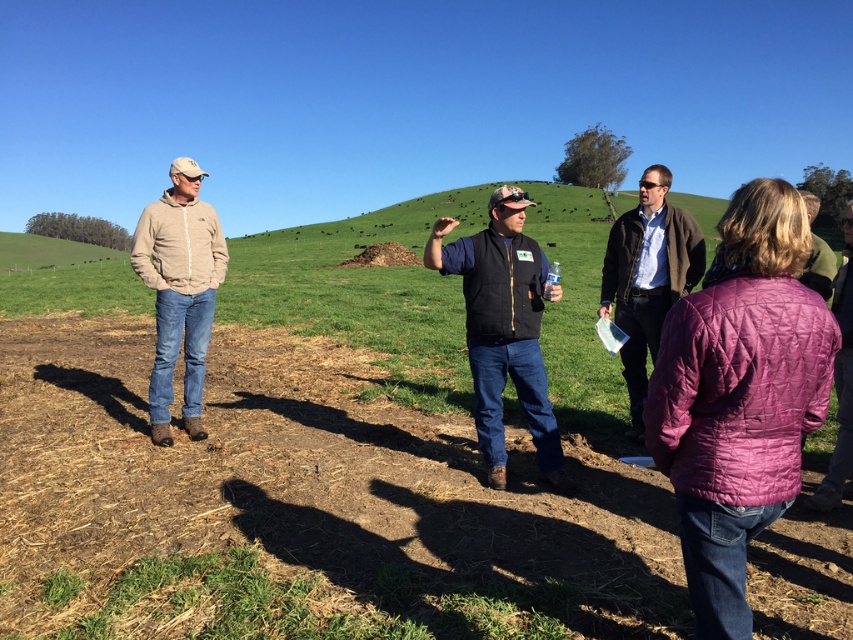
Which of these two, black softshell vest at center or brown woolen sweater at center, stands shorter?

With less height is black softshell vest at center.

Does point (538, 408) come behind point (656, 324)?

No, it is in front of (656, 324).

Identify the location of black softshell vest at center. This screenshot has height=640, width=853. (503, 328).

Which is more to the right, black softshell vest at center or beige fleece jacket at left?

From the viewer's perspective, black softshell vest at center appears more on the right side.

Where is `black softshell vest at center`? This screenshot has width=853, height=640. black softshell vest at center is located at coordinates (503, 328).

At what (x,y) coordinates should I click in order to perform the action: click on black softshell vest at center. Please return your answer as a coordinate pair (x, y). Looking at the image, I should click on (503, 328).

Can you confirm if beige fleece jacket at left is thinner than brown woolen sweater at center?

Yes.

Which is more to the left, beige fleece jacket at left or brown woolen sweater at center?

From the viewer's perspective, beige fleece jacket at left appears more on the left side.

Does point (160, 444) come behind point (616, 228)?

No, it is not.

The image size is (853, 640). What are the coordinates of `beige fleece jacket at left` in the screenshot? It's located at [178, 291].